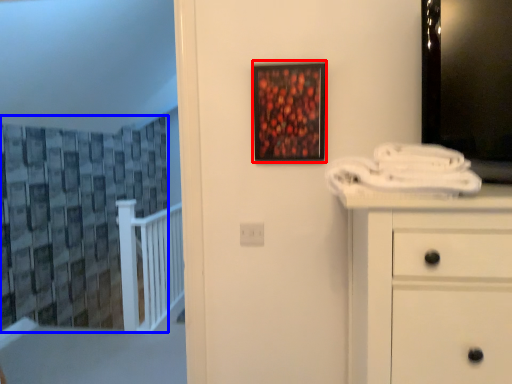
Question: Which point is closer to the camera, picture frame (highlighted by a red box) or curtain (highlighted by a blue box)?

Choices:
 (A) picture frame
 (B) curtain

Answer: (A)